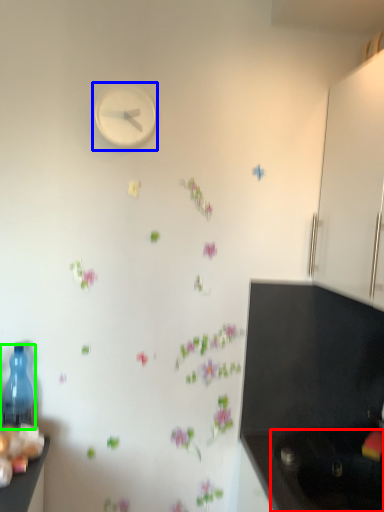
Question: Which is farther away from sink (highlighted by a red box)? clock (highlighted by a blue box) or bottle (highlighted by a green box)?

Choices:
 (A) clock
 (B) bottle

Answer: (A)